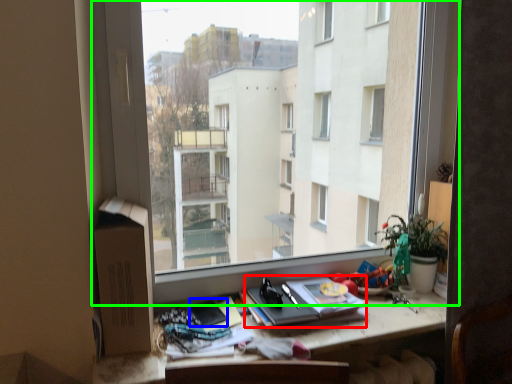
Question: Considering the real-world distances, which object is closest to paperback book (highlighted by a red box)? paperback book (highlighted by a blue box) or window (highlighted by a green box).

Choices:
 (A) paperback book
 (B) window

Answer: (A)